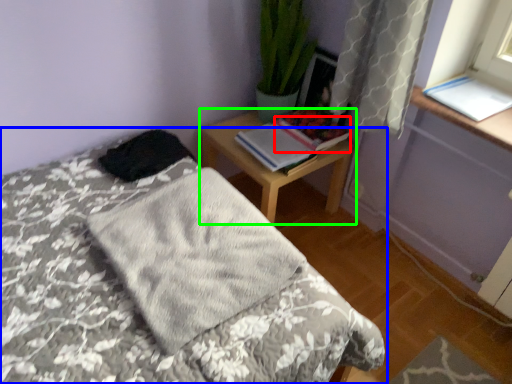
Question: Based on their relative distances, which object is nearer to book (highlighted by a red box)? Choose from bed (highlighted by a blue box) and nightstand (highlighted by a green box).

Choices:
 (A) bed
 (B) nightstand

Answer: (B)